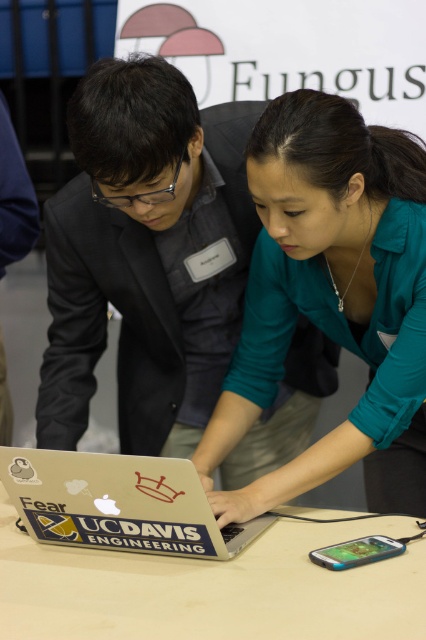
Can you confirm if matte black laptop at center is positioned above white matte table at center?

Correct, matte black laptop at center is located above white matte table at center.

Is matte black laptop at center thinner than white matte table at center?

Indeed, matte black laptop at center has a lesser width compared to white matte table at center.

Who is more forward, [147,147] or [322,592]?

Point [322,592]

Find the location of `matte black laptop at center`. matte black laptop at center is located at coordinates (146, 257).

Which is below, silver metallic laptop at center or teal plastic smartphone at lower center?

teal plastic smartphone at lower center is below.

Who is more forward, (x=37, y=486) or (x=313, y=554)?

Positioned in front is point (x=313, y=554).

Which is behind, point (97, 477) or point (310, 556)?

Point (310, 556)

I want to click on silver metallic laptop at center, so click(118, 502).

Which is below, teal fabric shirt at center or silver metallic laptop at center?

silver metallic laptop at center

This screenshot has height=640, width=426. What do you see at coordinates (328, 289) in the screenshot?
I see `teal fabric shirt at center` at bounding box center [328, 289].

You are a GUI agent. You are given a task and a screenshot of the screen. Output one action in this format:
    pyautogui.click(x=<x>, y=<y>)
    Task: Click on the teal fabric shirt at center
    
    Given the screenshot: What is the action you would take?
    pyautogui.click(x=328, y=289)

This screenshot has height=640, width=426. Find the location of `teal fabric shirt at center`. teal fabric shirt at center is located at coordinates (328, 289).